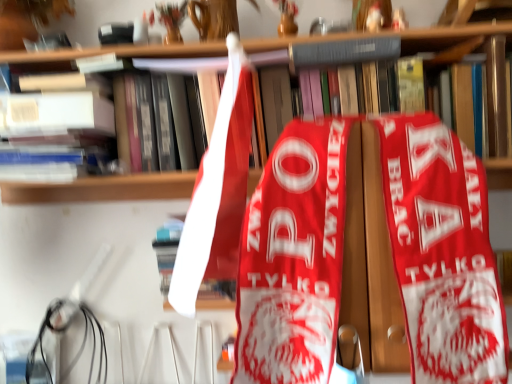
Question: Can you confirm if wooden bookcase at center is positioned to the right of hardcover book at upper center, which ranks as the second book in bottom-to-top order?

Choices:
 (A) yes
 (B) no

Answer: (B)

Question: From the image's perspective, is wooden bookcase at center over hardcover book at upper center, which is the 1th book in top-to-bottom order?

Choices:
 (A) no
 (B) yes

Answer: (A)

Question: Is wooden bookcase at center wider than hardcover book at upper center, the first book when ordered from right to left?

Choices:
 (A) no
 (B) yes

Answer: (B)

Question: From the image's perspective, is wooden bookcase at center located beneath hardcover book at upper center, the second book from the left?

Choices:
 (A) no
 (B) yes

Answer: (B)

Question: Is wooden bookcase at center not within hardcover book at upper center, the second book from the left?

Choices:
 (A) no
 (B) yes

Answer: (B)

Question: Relative to black rubber wire at lower left, is hardcover book at upper center, which is the 1th book in top-to-bottom order, in front or behind?

Choices:
 (A) behind
 (B) front

Answer: (B)

Question: Which is correct: hardcover book at upper center, the first book when ordered from right to left, is inside black rubber wire at lower left, or outside of it?

Choices:
 (A) outside
 (B) inside

Answer: (A)

Question: Looking at their shapes, would you say hardcover book at upper center, which is the 1th book in top-to-bottom order, is wider or thinner than black rubber wire at lower left?

Choices:
 (A) thin
 (B) wide

Answer: (B)

Question: Visually, is hardcover book at upper center, the first book when ordered from right to left, positioned to the left or to the right of black rubber wire at lower left?

Choices:
 (A) left
 (B) right

Answer: (B)

Question: From the image's perspective, is hardcover book at upper center, which is the 1th book in top-to-bottom order, positioned above or below matte white book at upper left, which is the second book from right to left?

Choices:
 (A) below
 (B) above

Answer: (B)

Question: Choose the correct answer: Is hardcover book at upper center, which is the 1th book in top-to-bottom order, inside matte white book at upper left, which is the second book from right to left, or outside it?

Choices:
 (A) outside
 (B) inside

Answer: (A)

Question: In terms of height, does hardcover book at upper center, the second book from the left, look taller or shorter compared to matte white book at upper left, which appears as the 2th book when viewed from the top?

Choices:
 (A) short
 (B) tall

Answer: (A)

Question: From a real-world perspective, is hardcover book at upper center, the first book when ordered from right to left, physically located above or below matte white book at upper left, which is the 1th book from left to right?

Choices:
 (A) above
 (B) below

Answer: (A)

Question: Do you think black rubber wire at lower left is within hardcover book at upper center, which ranks as the second book in bottom-to-top order, or outside of it?

Choices:
 (A) outside
 (B) inside

Answer: (A)

Question: Considering the positions of black rubber wire at lower left and hardcover book at upper center, the first book when ordered from right to left, in the image, is black rubber wire at lower left taller or shorter than hardcover book at upper center, the first book when ordered from right to left,?

Choices:
 (A) tall
 (B) short

Answer: (A)